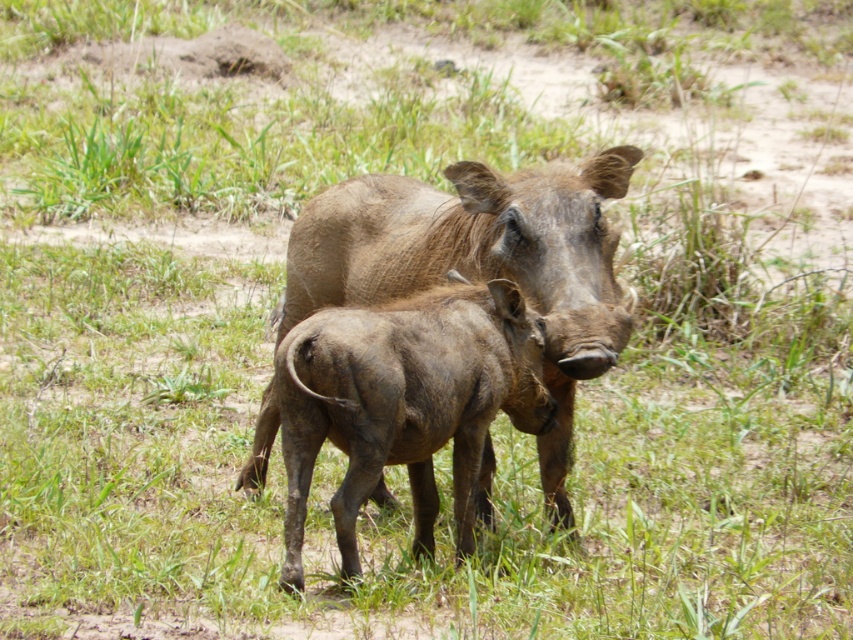
You are a wildlife photographer standing in a safari vehicle. You want to take a closeup photo of the brown textured pig at center. The camera you are using has a minimum focusing distance of 3 meters. Can you take the photo without moving the vehicle?

The brown textured pig at center and viewer are 3.66 meters apart from each other. Since the camera requires a minimum focusing distance of 3 meters, the photographer can take the closeup photo without moving the vehicle as the distance is sufficient.

You are a wildlife photographer aiming to capture both the brown textured pig at center and the brown textured warthog at center in a single frame. Based on their positions and sizes, which animal should you focus on first to ensure both fit in the shot?

The brown textured pig at center is wider than the brown textured warthog at center, so focusing on the wider pig first will help ensure both fit in the frame.

You are a wildlife photographer aiming to capture a clear photo of both the brown textured pig at center and the brown textured warthog at center. However, you notice that one is blocking the other. Which animal is obscuring the view of the other?

The brown textured pig at center is positioned over the brown textured warthog at center, so the pig is obscuring the view of the warthog.